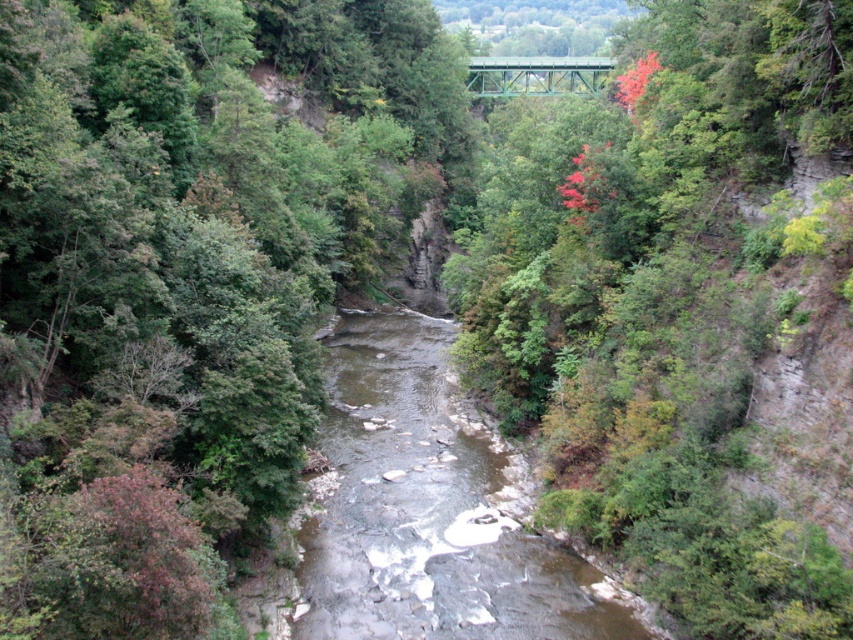
Question: Which of the following is the closest to the observer?

Choices:
 (A) green metal bridge at upper center
 (B) brown rocky stream at center

Answer: (B)

Question: Is brown rocky stream at center smaller than green metal bridge at upper center?

Choices:
 (A) no
 (B) yes

Answer: (B)

Question: Can you confirm if brown rocky stream at center is positioned to the left of green metal bridge at upper center?

Choices:
 (A) yes
 (B) no

Answer: (A)

Question: Does brown rocky stream at center have a lesser width compared to green metal bridge at upper center?

Choices:
 (A) yes
 (B) no

Answer: (A)